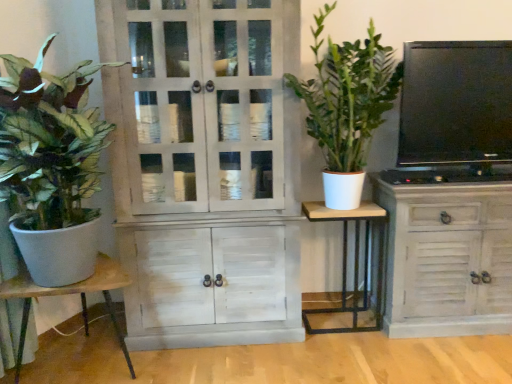
Find the location of `free location in front of white wood table at center, arranged as the 2th table when viewed from the left`. free location in front of white wood table at center, arranged as the 2th table when viewed from the left is located at coordinates (348, 353).